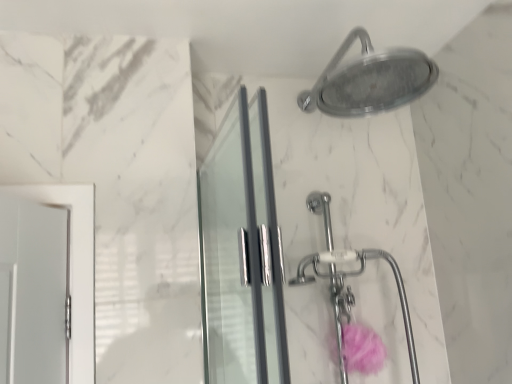
Describe the element at coordinates (242, 251) in the screenshot. The width and height of the screenshot is (512, 384). I see `clear glass screen door at center` at that location.

Locate an element on the screen. The width and height of the screenshot is (512, 384). clear glass screen door at center is located at coordinates (242, 251).

Where is `clear glass screen door at center`? clear glass screen door at center is located at coordinates (242, 251).